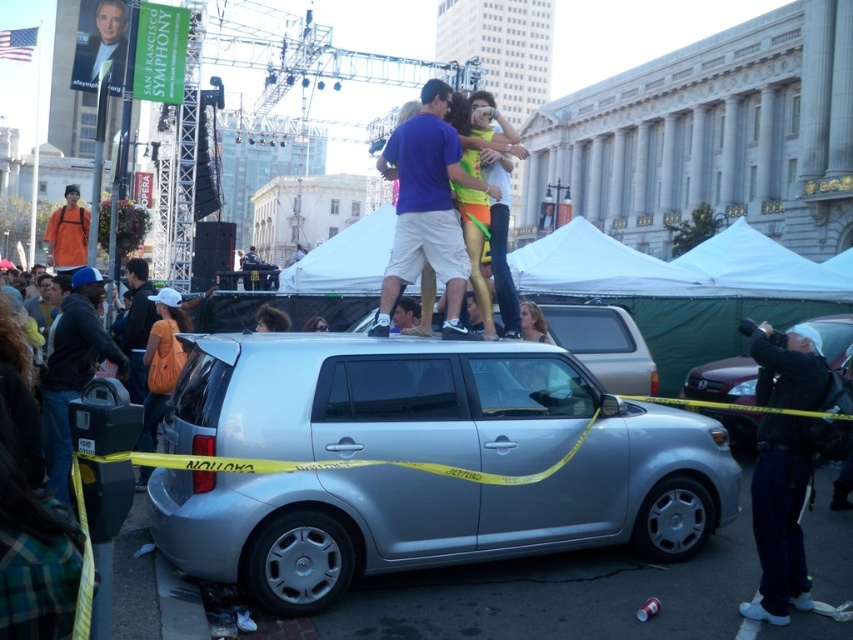
You are a pedestrian trying to get to the other side of the street. You see the silver metallic hatchback at center and the orange fabric shirt at left. Which object is closer to the ground?

The silver metallic hatchback at center is located below orange fabric shirt at left, so it is closer to the ground.

In the scene shown: You are a photographer trying to capture the silver metallic hatchback at center from a specific point. The coordinates given are point (x=723, y=380). Can you confirm if this point is the exact location of the silver metallic hatchback at center?

Yes, the point (x=723, y=380) corresponds exactly to the silver metallic hatchback at center as stated in the Objects Description.